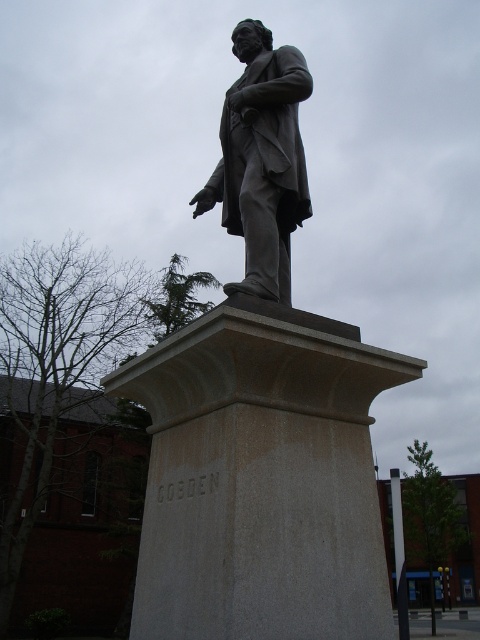
You are an art student observing the statue scene. You notice two statues at the center. Which one is closer to you, the gray polished stone statue at center or the bronze statue at center?

The gray polished stone statue at center is closer to the viewer than the bronze statue at center.

You are standing in front of the statue of GOSDEN. There is a point at coordinates (261, 413). Can you tell me what object this point is located on?

The point at coordinates (261, 413) is located on the gray polished stone statue at center.

You are an art curator planning to display both the gray polished stone statue at center and the bronze statue at center in a gallery. Which statue requires a wider base to accommodate its size?

The gray polished stone statue at center requires a wider base because its width is larger than the bronze statue at center.